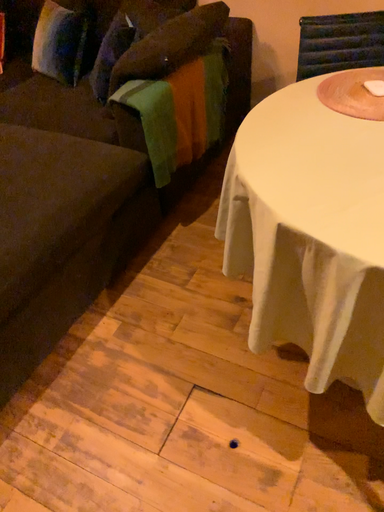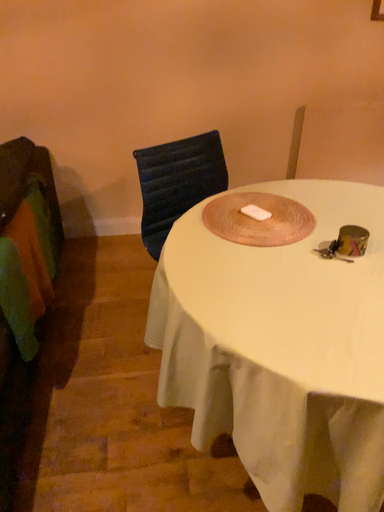
Question: How did the camera likely rotate when shooting the video?

Choices:
 (A) rotated left
 (B) rotated right

Answer: (B)